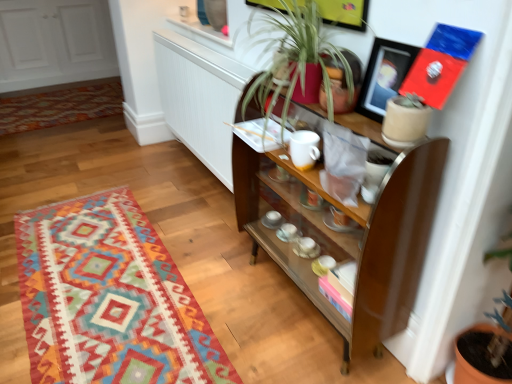
The height and width of the screenshot is (384, 512). Identify the location of vacant space that's between brown wooden shelf at center and textured wool rug at lower left, which ranks as the 1th mat in bottom-to-top order. (234, 273).